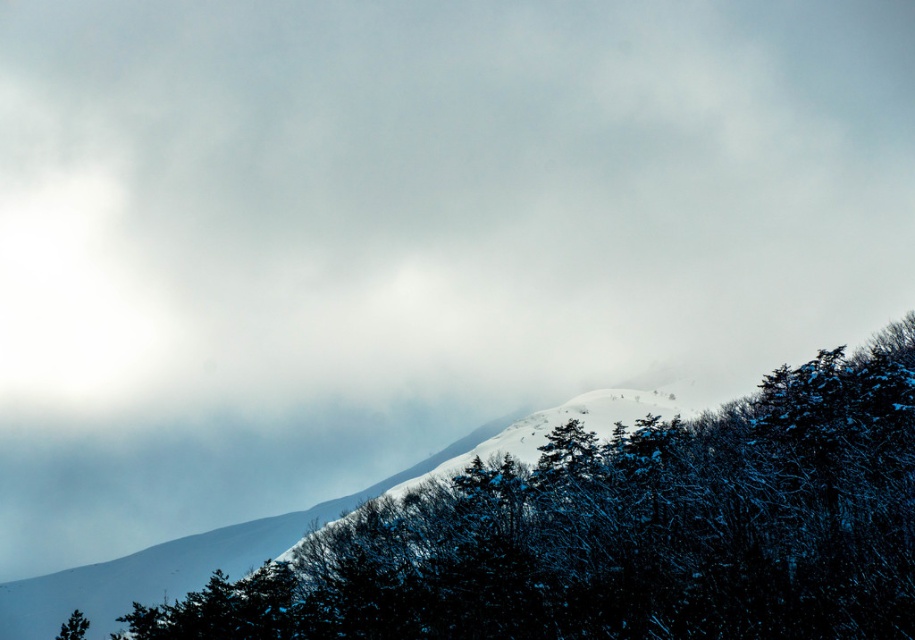
Identify the location of snowy evergreen trees at center. The height and width of the screenshot is (640, 915). (625, 531).

Which is in front, point (756, 536) or point (81, 627)?

Point (756, 536) is in front.

Identify the location of snowy evergreen trees at center. The image size is (915, 640). (625, 531).